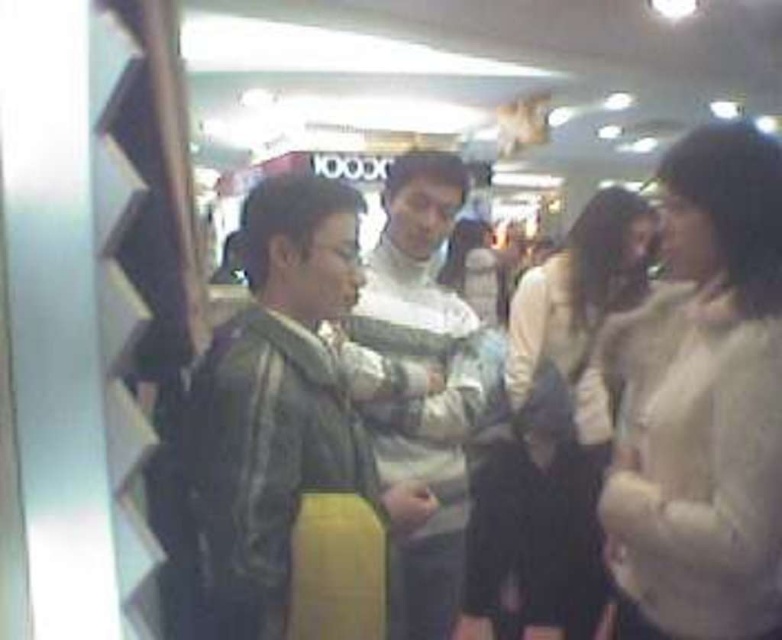
From the picture: You are standing at the camera position and want to hand a brochure to the person wearing the leather jacket at center. Given that the average human arm length is about 2.5 feet, can you reach them without moving your feet?

The distance between the leather jacket at center and the camera is 4.19 feet, which is greater than the average human arm length of 2.5 feet. Therefore, you cannot reach them without moving your feet.

You are a photographer trying to capture a clear shot of two specific points in the scene. Given the blurriness of the image, can you determine which of the two points, point 1 at coordinates point (339, 436) or point 2 at coordinates point (558, 568), is closer to the camera to ensure proper focus?

Point (339, 436) is closer to the camera than point (558, 568), so you should focus on point (339, 436) to ensure proper focus.